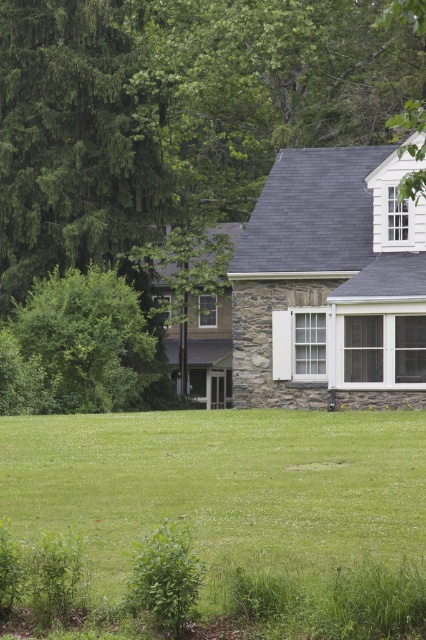
You are standing in the suburban scene and want to walk from the green leafy bush at left to the green grass at center. Which direction should you move?

You should move to the right, as the green grass at center is to the right of the green leafy bush at left.